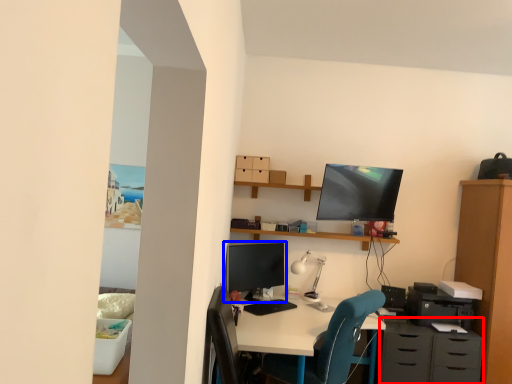
Question: Which of the following is the farthest to the observer, dresser (highlighted by a red box) or computer monitor (highlighted by a blue box)?

Choices:
 (A) dresser
 (B) computer monitor

Answer: (B)